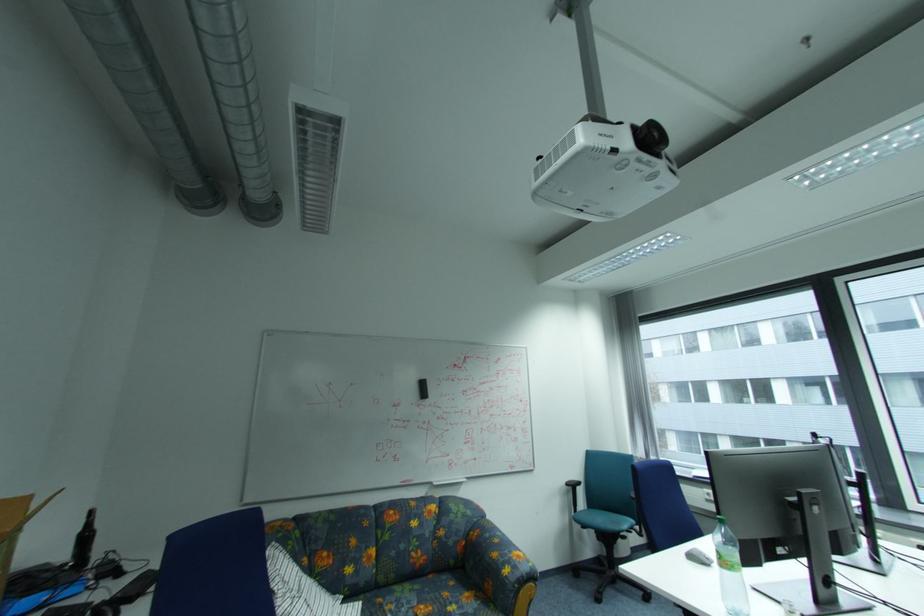
At what (x,y) coordinates should I click in order to perform the action: click on floral sofa sitting surface. Please return your answer as a coordinate pair (x, y). Looking at the image, I should click on (421, 602).